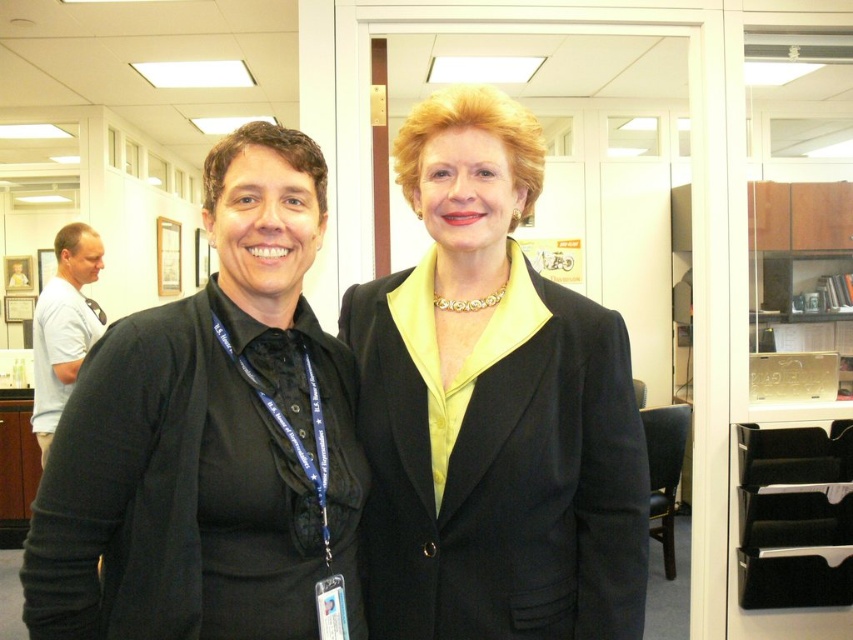
Question: Is black satin blazer at center further to camera compared to black matte blazer at left?

Choices:
 (A) no
 (B) yes

Answer: (B)

Question: Does black satin blazer at center have a greater width compared to black matte blazer at left?

Choices:
 (A) yes
 (B) no

Answer: (A)

Question: Which point is closer to the camera taking this photo?

Choices:
 (A) (115, 632)
 (B) (526, 532)

Answer: (A)

Question: Among these points, which one is nearest to the camera?

Choices:
 (A) (384, 620)
 (B) (138, 381)

Answer: (B)

Question: Can you confirm if black satin blazer at center is wider than black matte blazer at left?

Choices:
 (A) no
 (B) yes

Answer: (B)